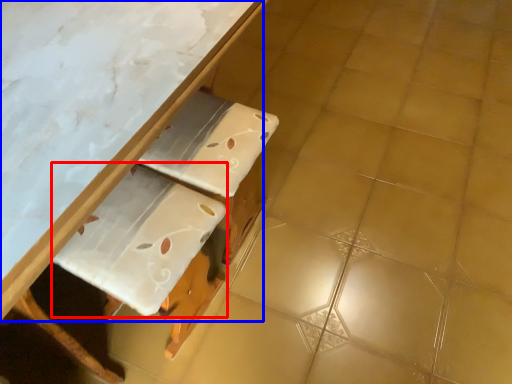
Question: Which object is further to the camera taking this photo, cardboard (highlighted by a red box) or table (highlighted by a blue box)?

Choices:
 (A) cardboard
 (B) table

Answer: (A)